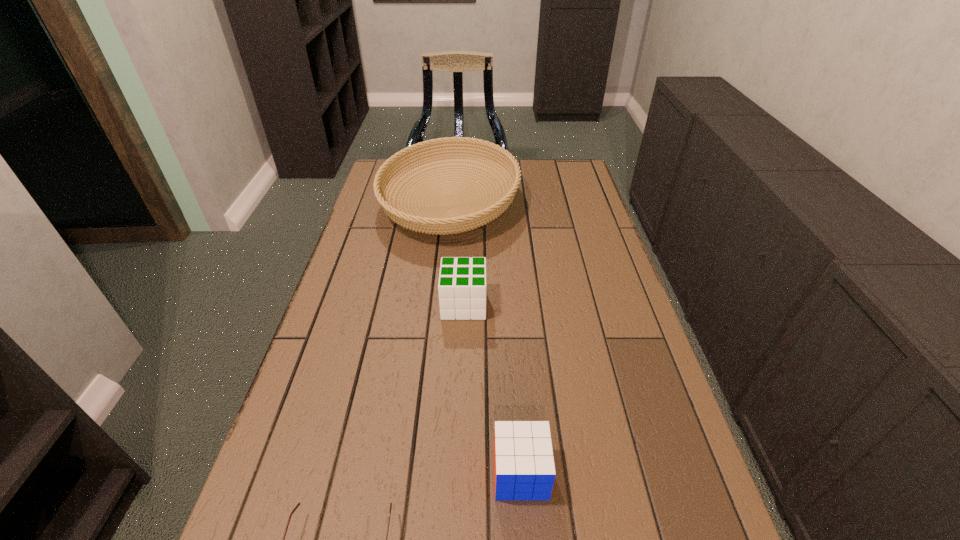
This screenshot has width=960, height=540. Identify the location of object that ranks as the third closest to the shortest object. (433, 220).

Identify which object is located as the third nearest to the third nearest object. Please provide its 2D coordinates. Your answer should be formatted as a tuple, i.e. [(x, y)], where the tuple contains the x and y coordinates of a point satisfying the conditions above.

[(298, 504)]

Image resolution: width=960 pixels, height=540 pixels. I want to click on vacant region that satisfies the following two spatial constraints: 1. on the red face of the third farthest object; 2. on the right side of the left cube, so click(457, 474).

I want to click on free space that satisfies the following two spatial constraints: 1. on the front side of the nearer cube; 2. on the right side of the basket, so click(x=424, y=474).